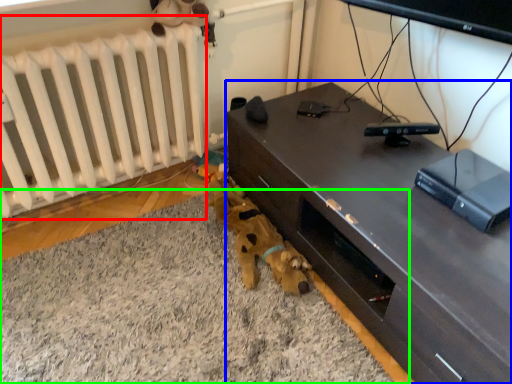
Question: Considering the real-world distances, which object is farthest from radiator (highlighted by a red box)? desk (highlighted by a blue box) or plain (highlighted by a green box)?

Choices:
 (A) desk
 (B) plain

Answer: (A)